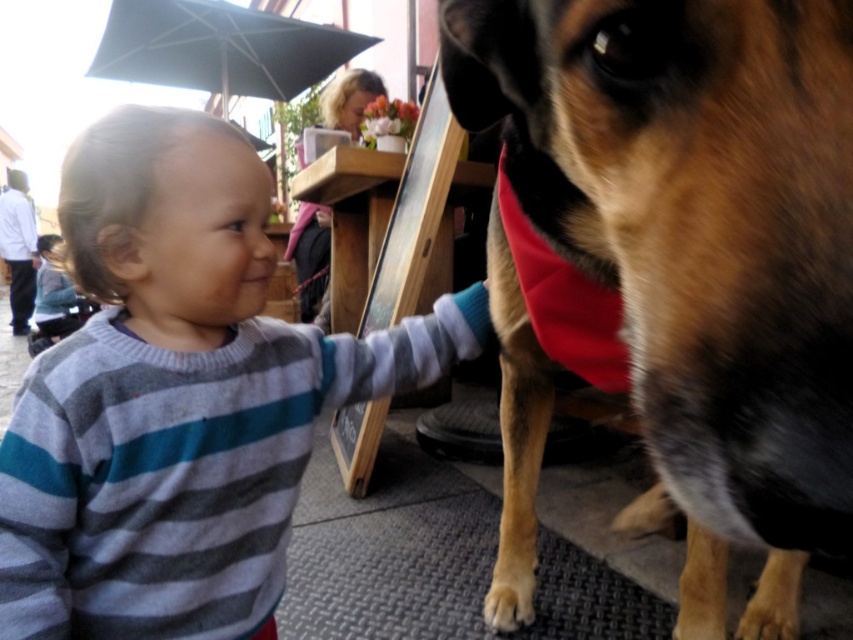
You are a photographer trying to capture the child and the dog in the scene. Since the striped sweater at center and the blonde hair at upper center are both important elements, which one should you focus on to ensure it takes up more space in the photo?

The blonde hair at upper center should be focused on because it occupies more space than the striped sweater at center, so it will naturally take up more of the photo frame.